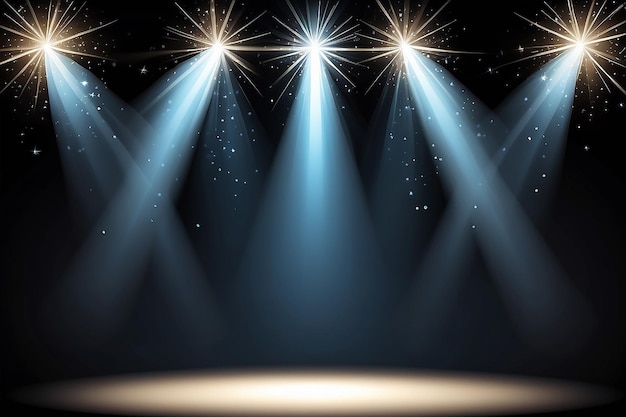
Where is `spotlights`? This screenshot has width=626, height=417. spotlights is located at coordinates (44, 45), (222, 48), (314, 45), (402, 41), (576, 40).